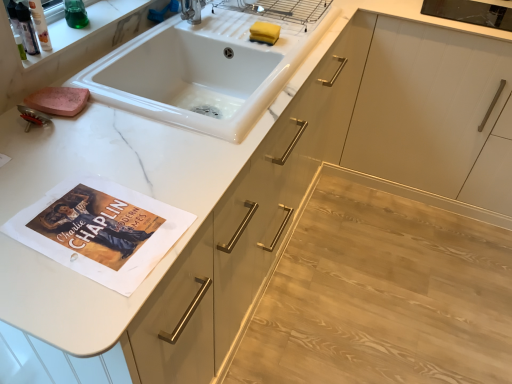
Question: Does white glossy sink at upper center have a greater height compared to yellow sponge at sink?

Choices:
 (A) no
 (B) yes

Answer: (B)

Question: Considering the relative sizes of white glossy sink at upper center and yellow sponge at sink in the image provided, is white glossy sink at upper center shorter than yellow sponge at sink?

Choices:
 (A) no
 (B) yes

Answer: (A)

Question: Is white glossy sink at upper center touching yellow sponge at sink?

Choices:
 (A) no
 (B) yes

Answer: (A)

Question: Can you confirm if white glossy sink at upper center is positioned to the left of yellow sponge at sink?

Choices:
 (A) yes
 (B) no

Answer: (A)

Question: Does white glossy sink at upper center have a smaller size compared to yellow sponge at sink?

Choices:
 (A) no
 (B) yes

Answer: (A)

Question: Is the position of white glossy sink at upper center less distant than that of yellow sponge at sink?

Choices:
 (A) no
 (B) yes

Answer: (B)

Question: Can you confirm if white marble shelf at upper left is taller than white glossy sink at upper center?

Choices:
 (A) yes
 (B) no

Answer: (B)

Question: Is white marble shelf at upper left wider than white glossy sink at upper center?

Choices:
 (A) no
 (B) yes

Answer: (A)

Question: Considering the relative positions of white marble shelf at upper left and white glossy sink at upper center in the image provided, is white marble shelf at upper left in front of white glossy sink at upper center?

Choices:
 (A) no
 (B) yes

Answer: (A)

Question: Is white marble shelf at upper left not inside white glossy sink at upper center?

Choices:
 (A) no
 (B) yes

Answer: (B)

Question: From a real-world perspective, is white marble shelf at upper left over white glossy sink at upper center?

Choices:
 (A) yes
 (B) no

Answer: (A)

Question: Is white marble shelf at upper left surrounding white glossy sink at upper center?

Choices:
 (A) yes
 (B) no

Answer: (B)

Question: Is white glossy sink at upper center shorter than white marble shelf at upper left?

Choices:
 (A) yes
 (B) no

Answer: (B)